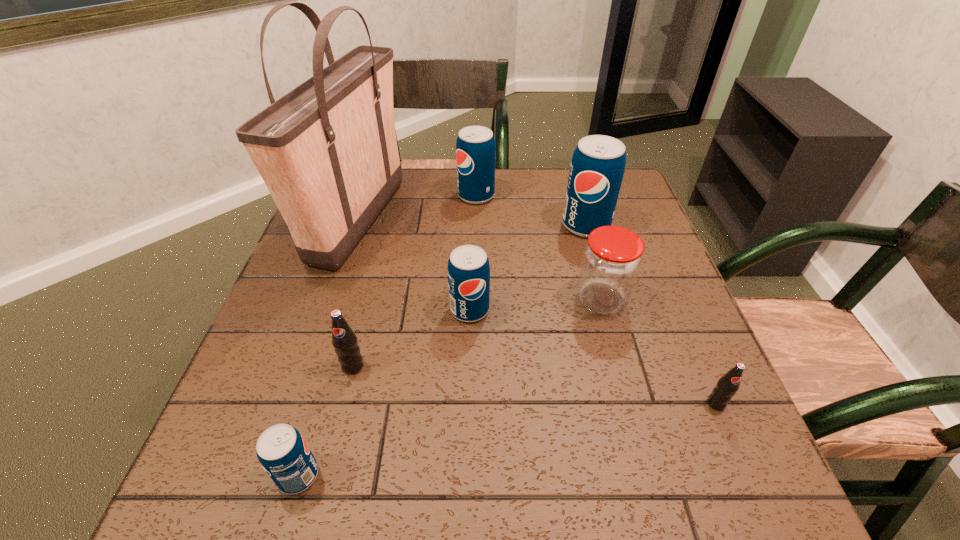
Image resolution: width=960 pixels, height=540 pixels. I want to click on vacant space located on the front label of the fifth farthest pop, so click(x=740, y=461).

In order to click on vacant area situated 0.130m on the left of the nearest blue pop in this screenshot , I will do [199, 475].

Image resolution: width=960 pixels, height=540 pixels. Identify the location of shopping bag at the far edge. (327, 151).

Locate an element on the screen. object located at the near edge is located at coordinates (282, 451).

Locate an element on the screen. shopping bag that is at the left edge is located at coordinates (327, 151).

What are the coordinates of `pop located at the left edge` in the screenshot? It's located at (282, 451).

Locate an element on the screen. The width and height of the screenshot is (960, 540). jar located at the right edge is located at coordinates (611, 261).

Locate an element on the screen. The image size is (960, 540). object that is at the far left corner is located at coordinates (327, 151).

The width and height of the screenshot is (960, 540). Find the location of `object that is at the near left corner`. object that is at the near left corner is located at coordinates (282, 451).

The image size is (960, 540). I want to click on object that is at the far right corner, so click(x=597, y=168).